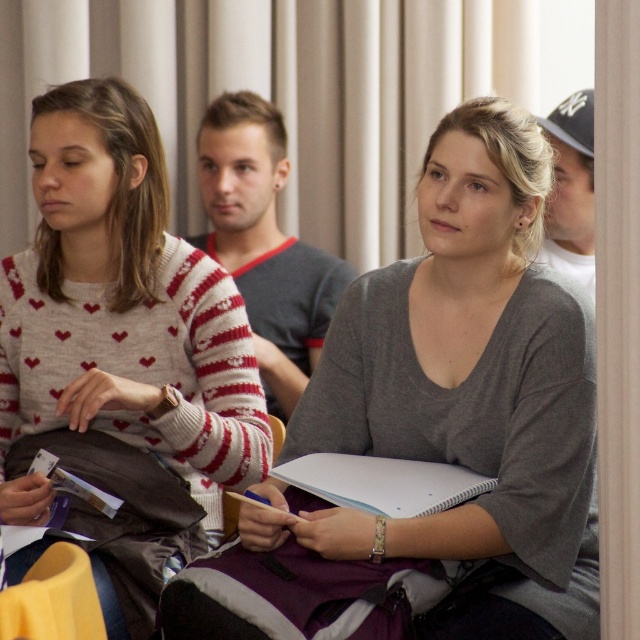
You are organizing a small event and need to place a name tag on the table. You have a gray matte sweater at center and a white paper notebook at center in front of you. Which item should you place the name tag on to ensure it is visible and accessible?

The gray matte sweater at center is larger in size than the white paper notebook at center, so placing the name tag on the gray matte sweater at center would provide a more visible and accessible surface.